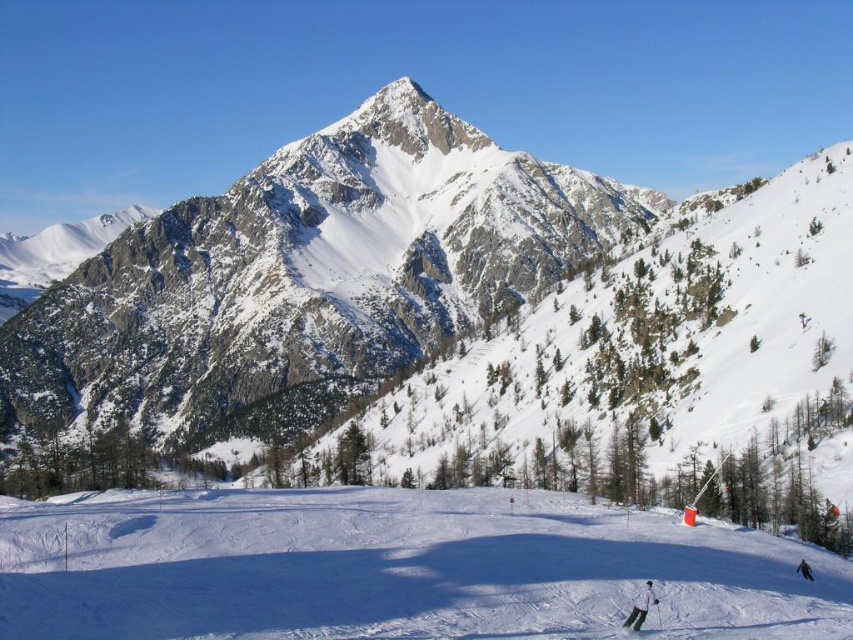
Which is more to the left, white snow ski slope at center or white matte ski at lower right?

white snow ski slope at center is more to the left.

Who is lower down, white snow ski slope at center or white matte ski at lower right?

white matte ski at lower right is below.

Which is behind, point (480, 500) or point (660, 634)?

The point (480, 500) is more distant.

This screenshot has width=853, height=640. Identify the location of white snow ski slope at center. (397, 570).

Who is more forward, [523,269] or [228,628]?

Point [228,628]

Who is higher up, snowy granite mountain at upper center or white snow ski slope at center?

snowy granite mountain at upper center is higher up.

The image size is (853, 640). I want to click on snowy granite mountain at upper center, so click(x=303, y=280).

The height and width of the screenshot is (640, 853). What do you see at coordinates (640, 605) in the screenshot? I see `white matte jacket at lower right` at bounding box center [640, 605].

Which is above, white matte jacket at lower right or white matte ski at lower right?

Positioned higher is white matte jacket at lower right.

Where is `white matte jacket at lower right`? Image resolution: width=853 pixels, height=640 pixels. white matte jacket at lower right is located at coordinates (640, 605).

Image resolution: width=853 pixels, height=640 pixels. In order to click on white matte jacket at lower right in this screenshot , I will do `click(640, 605)`.